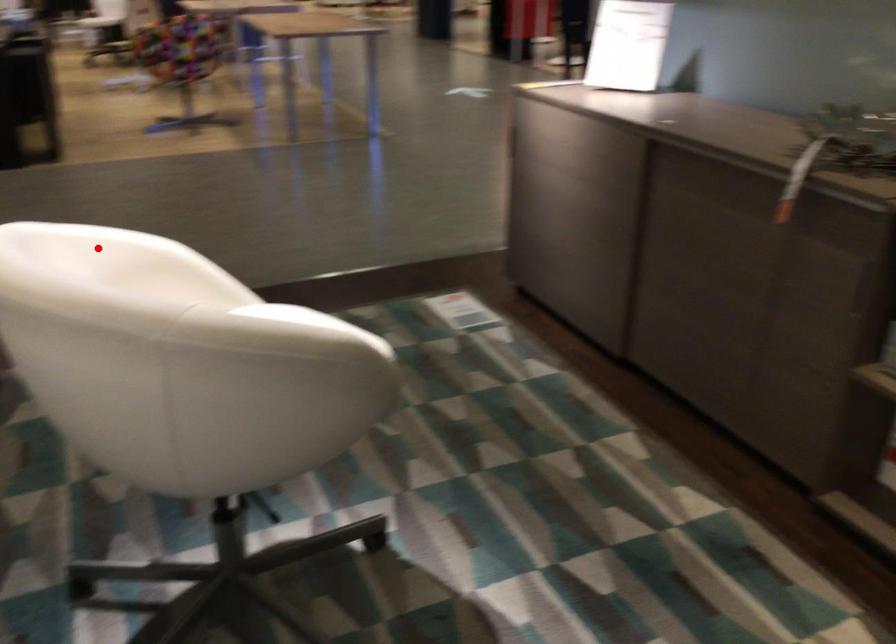
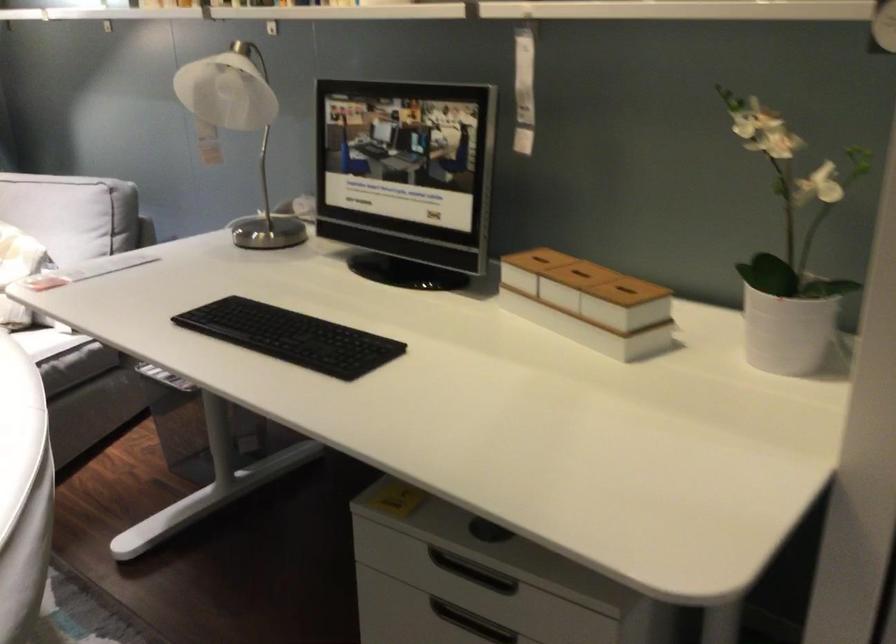
Where in the second image is the point corresponding to the highlighted location from the first image?

(22, 489)